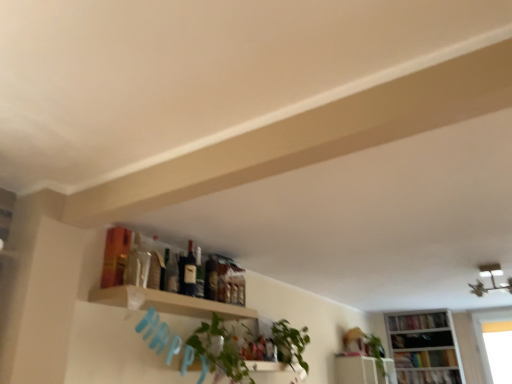
Question: Is green glass bottle at center, the 2th bottle positioned from the front, at the left side of green leafy plant at center?

Choices:
 (A) no
 (B) yes

Answer: (B)

Question: From the image's perspective, is green glass bottle at center, positioned as the 1th bottle in back-to-front order, below green leafy plant at center?

Choices:
 (A) no
 (B) yes

Answer: (A)

Question: From the image's perspective, is green glass bottle at center, positioned as the 1th bottle in back-to-front order, on top of green leafy plant at center?

Choices:
 (A) yes
 (B) no

Answer: (A)

Question: Can you confirm if green glass bottle at center, the 2th bottle positioned from the front, is positioned to the right of green leafy plant at center?

Choices:
 (A) no
 (B) yes

Answer: (A)

Question: Is green glass bottle at center, the 2th bottle positioned from the front, looking in the opposite direction of green leafy plant at center?

Choices:
 (A) no
 (B) yes

Answer: (A)

Question: Considering the relative sizes of green glass bottle at center, positioned as the 1th bottle in back-to-front order, and green leafy plant at center in the image provided, is green glass bottle at center, positioned as the 1th bottle in back-to-front order, bigger than green leafy plant at center?

Choices:
 (A) yes
 (B) no

Answer: (B)

Question: From the image's perspective, would you say white glossy shelf at upper center, which ranks as the 1th shelf in bottom-to-top order, is positioned over green leafy plant at upper center?

Choices:
 (A) no
 (B) yes

Answer: (A)

Question: Is white glossy shelf at upper center, which is the 2th shelf from front to back, wider than green leafy plant at upper center?

Choices:
 (A) no
 (B) yes

Answer: (B)

Question: Are white glossy shelf at upper center, the 1th shelf from the back, and green leafy plant at upper center making contact?

Choices:
 (A) no
 (B) yes

Answer: (A)

Question: Considering the relative sizes of white glossy shelf at upper center, which is the 2th shelf from front to back, and green leafy plant at upper center in the image provided, is white glossy shelf at upper center, which is the 2th shelf from front to back, taller than green leafy plant at upper center?

Choices:
 (A) yes
 (B) no

Answer: (B)

Question: From a real-world perspective, is white glossy shelf at upper center, which is the 2th shelf from front to back, physically below green leafy plant at upper center?

Choices:
 (A) yes
 (B) no

Answer: (A)

Question: Is white glossy shelf at upper center, the 1th shelf from the back, closer to the viewer compared to green leafy plant at upper center?

Choices:
 (A) yes
 (B) no

Answer: (B)

Question: Is matte glass bottle at center, arranged as the 1th bottle when viewed from the front, to the left of green leafy plant at center from the viewer's perspective?

Choices:
 (A) yes
 (B) no

Answer: (A)